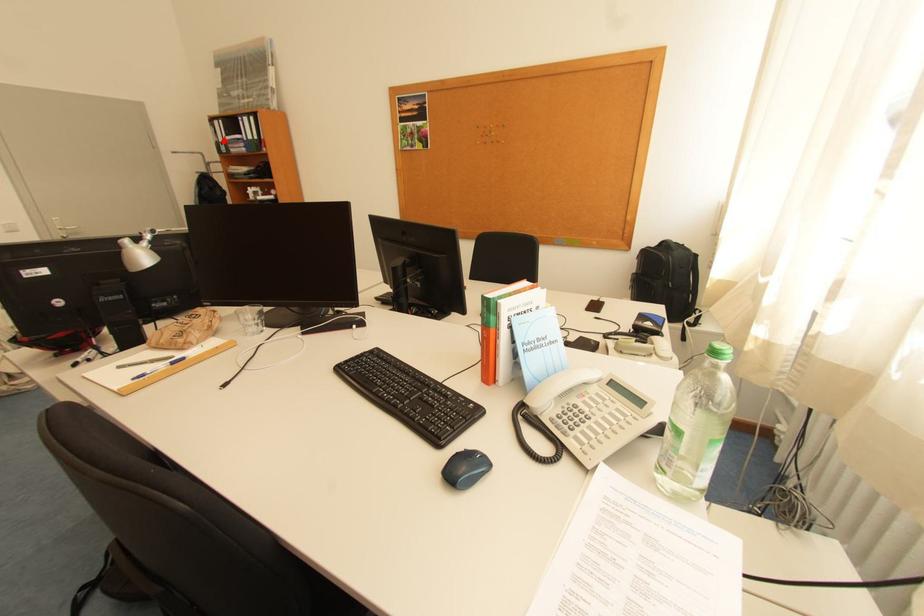
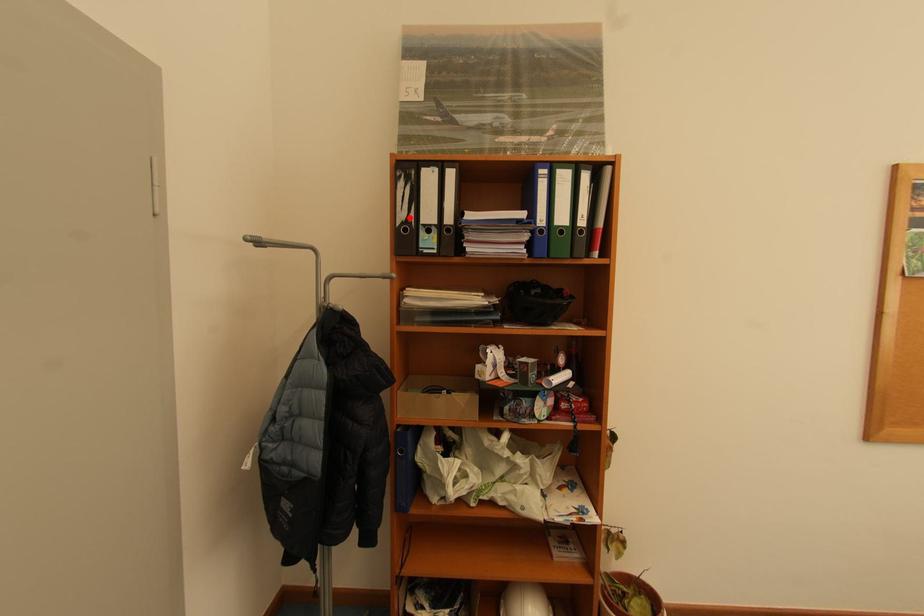
I am providing you with two images of the same scene from different viewpoints. A red point is marked on the first image and another point is marked on the second image. Do the highlighted points in image1 and image2 indicate the same real-world spot?

Yes